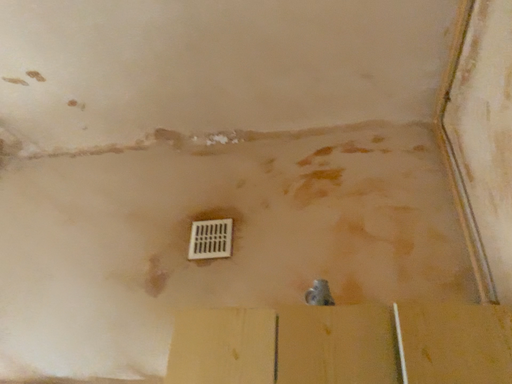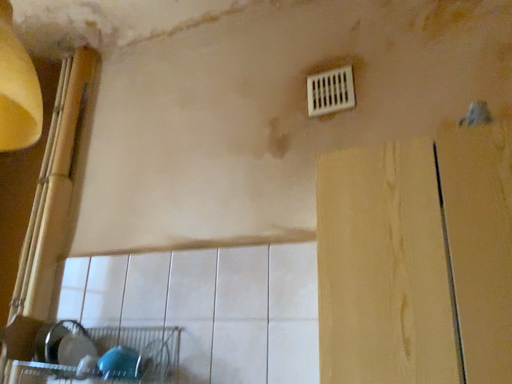
Question: Which way did the camera rotate in the video?

Choices:
 (A) rotated right
 (B) rotated left

Answer: (B)